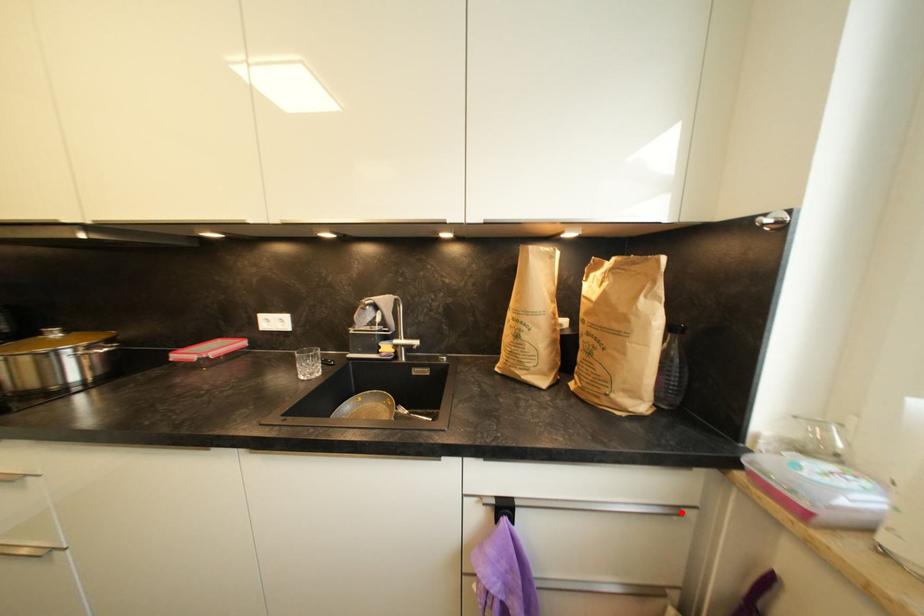
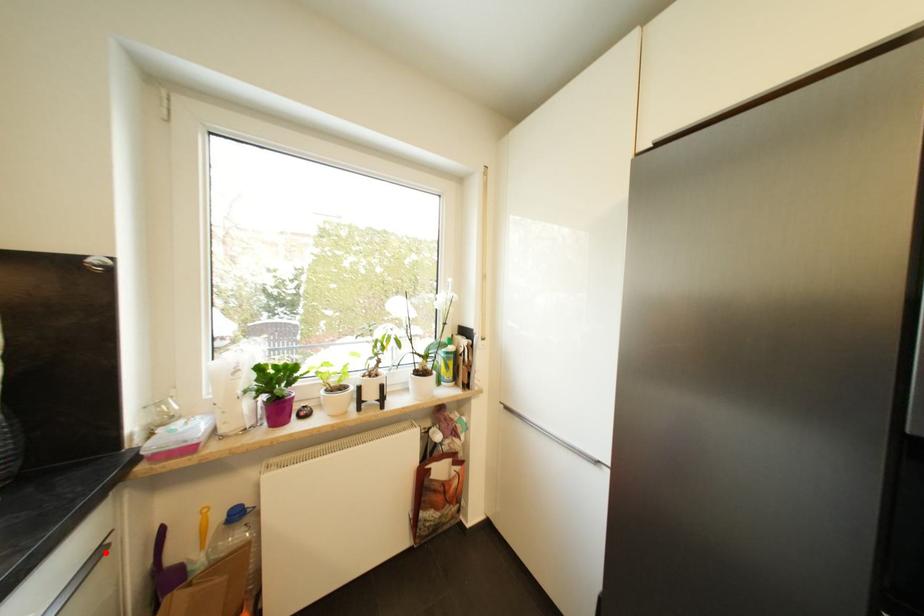
I am providing you with two images of the same scene from different viewpoints. A red point is marked on the first image and another point is marked on the second image. Do the highlighted points in image1 and image2 indicate the same real-world spot?

Yes